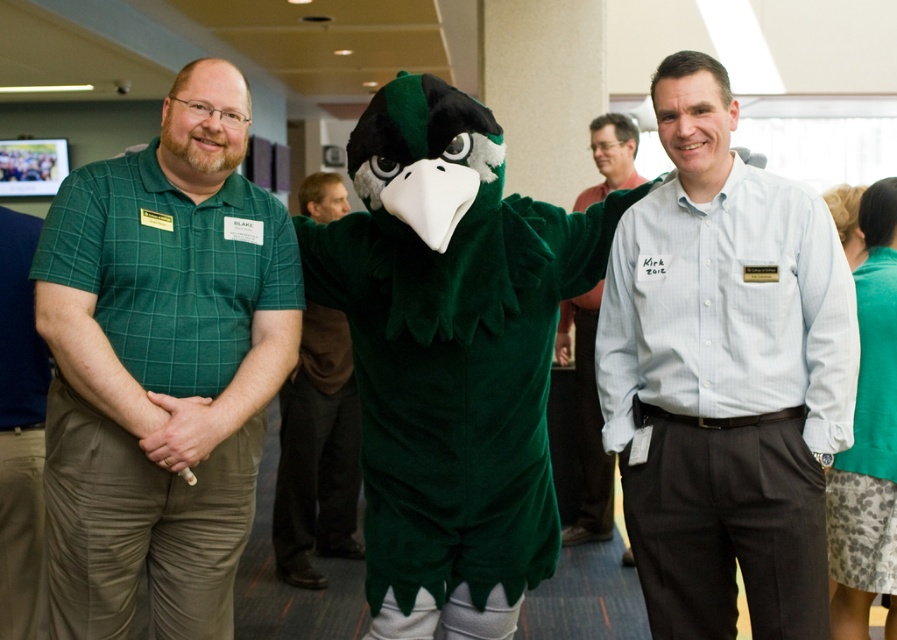
Question: Considering the real-world distances, which object is farthest from the light blue shirt at center?

Choices:
 (A) green textured dress at right
 (B) green plush mascot at center

Answer: (A)

Question: Which of these objects is positioned farthest from the green textured dress at right?

Choices:
 (A) white shirt at center
 (B) green plush mascot at center
 (C) green plaid shirt at left
 (D) light blue shirt at center

Answer: (B)

Question: Is white shirt at center wider than green textured dress at right?

Choices:
 (A) no
 (B) yes

Answer: (B)

Question: Is green plush mascot at center positioned behind light blue shirt at center?

Choices:
 (A) yes
 (B) no

Answer: (B)

Question: Does green plaid shirt at left have a greater width compared to green textured dress at right?

Choices:
 (A) no
 (B) yes

Answer: (B)

Question: Among these objects, which one is farthest from the camera?

Choices:
 (A) green plaid shirt at left
 (B) green textured dress at right

Answer: (B)